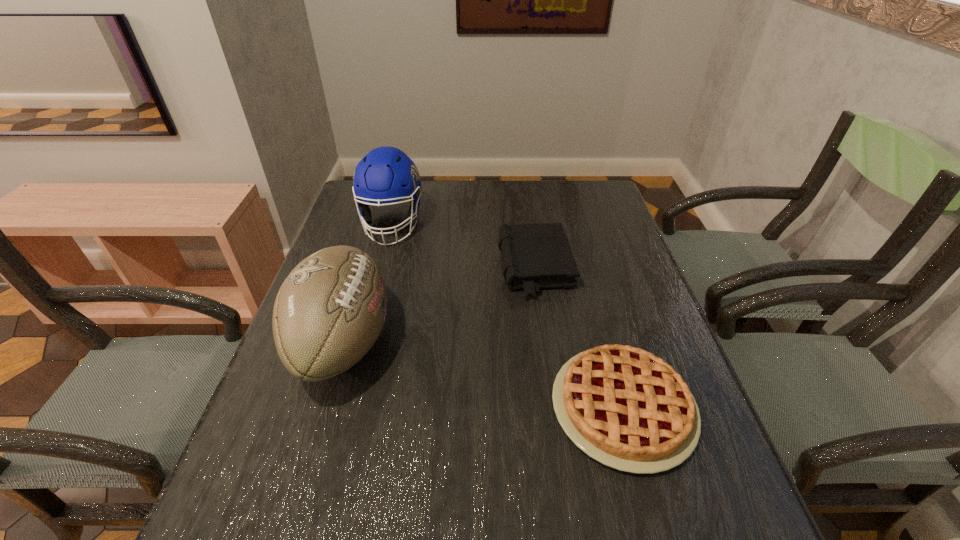
Where is `football (American) located at the left edge`? The image size is (960, 540). football (American) located at the left edge is located at coordinates [x=330, y=310].

This screenshot has height=540, width=960. In order to click on object positioned at the right edge in this screenshot , I will do `click(628, 409)`.

This screenshot has width=960, height=540. What are the coordinates of `object that is positioned at the far left corner` in the screenshot? It's located at (386, 175).

Where is `vacant region at the far edge`? This screenshot has width=960, height=540. vacant region at the far edge is located at coordinates (509, 197).

Where is `free space at the left edge of the desktop`? free space at the left edge of the desktop is located at coordinates (289, 397).

In the image, there is a desktop. Identify the location of vacant space at the right edge. This screenshot has width=960, height=540. (599, 338).

The width and height of the screenshot is (960, 540). Find the location of `free spot between the second shortest object and the football (American)`. free spot between the second shortest object and the football (American) is located at coordinates (439, 305).

Find the location of a particular element. The height and width of the screenshot is (540, 960). free space between the pie and the football (American) is located at coordinates (483, 375).

This screenshot has height=540, width=960. In order to click on free space that is in between the football (American) and the pie in this screenshot , I will do tap(483, 375).

Find the location of a particular element. blank region between the Bible and the shortest object is located at coordinates (579, 338).